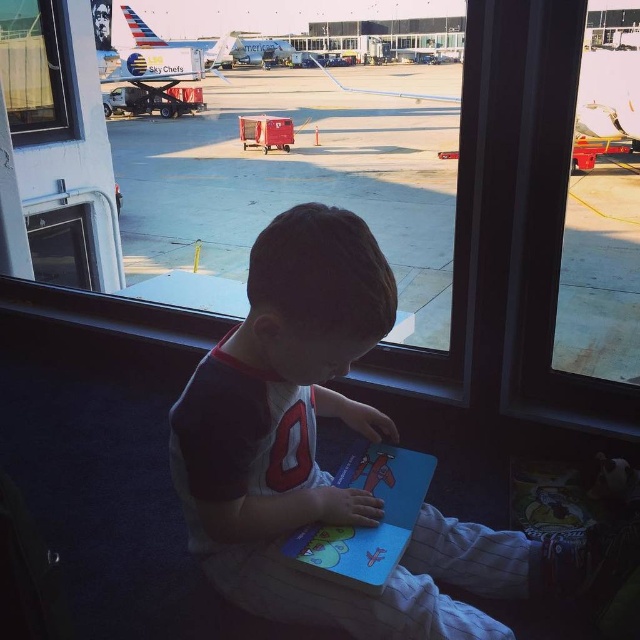
Between white cotton shirt at center and transparent glass window at upper left, which one has more height?

transparent glass window at upper left

Between white cotton shirt at center and transparent glass window at upper left, which one is positioned lower?

Positioned lower is white cotton shirt at center.

Does point (310, 234) lie in front of point (36, 141)?

Yes, it is in front of point (36, 141).

Locate an element on the screen. The image size is (640, 640). white cotton shirt at center is located at coordinates (314, 449).

Does point (394, 477) come behind point (211, 64)?

No.

Does matte blue book at center appear on the left side of white glossy airplane at upper center?

Incorrect, matte blue book at center is not on the left side of white glossy airplane at upper center.

Is point (394, 500) less distant than point (156, 54)?

That is True.

Where is `matte blue book at center`? matte blue book at center is located at coordinates (368, 528).

Does transparent glass window at upper left appear on the left side of metallic silver airplane at center?

Correct, you'll find transparent glass window at upper left to the left of metallic silver airplane at center.

What do you see at coordinates (36, 72) in the screenshot?
I see `transparent glass window at upper left` at bounding box center [36, 72].

Where is `transparent glass window at upper left`? transparent glass window at upper left is located at coordinates (36, 72).